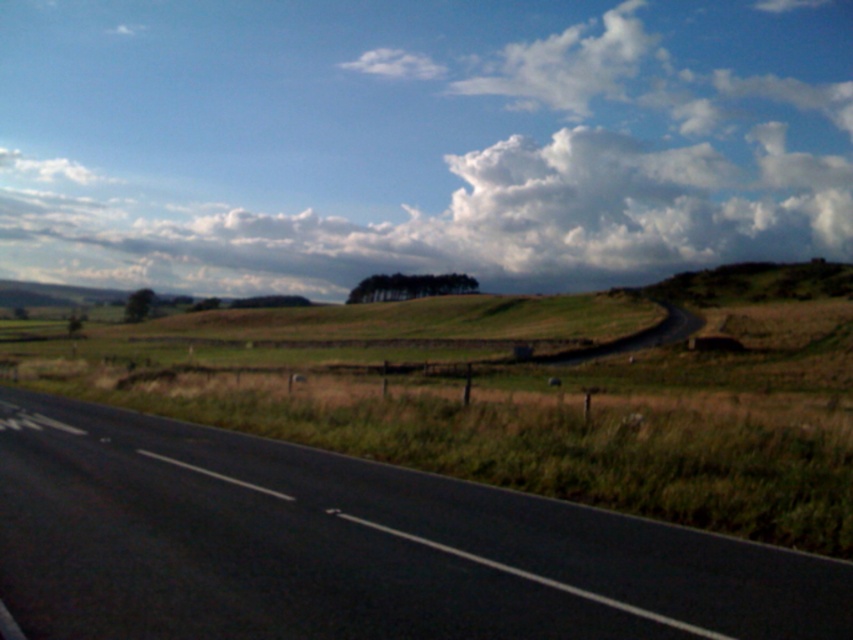
Question: Which point is farther to the camera?

Choices:
 (A) white fluffy cloud at upper center
 (B) black asphalt highway at lower left

Answer: (A)

Question: Can you confirm if white fluffy cloud at upper center is positioned to the right of black asphalt highway at lower left?

Choices:
 (A) yes
 (B) no

Answer: (B)

Question: Which point is closer to the camera taking this photo?

Choices:
 (A) (198, 428)
 (B) (334, 228)

Answer: (A)

Question: Is white fluffy cloud at upper center thinner than black asphalt highway at lower left?

Choices:
 (A) yes
 (B) no

Answer: (B)

Question: Among these objects, which one is nearest to the camera?

Choices:
 (A) black asphalt highway at lower left
 (B) white fluffy cloud at upper center

Answer: (A)

Question: Does white fluffy cloud at upper center come in front of black asphalt highway at lower left?

Choices:
 (A) no
 (B) yes

Answer: (A)